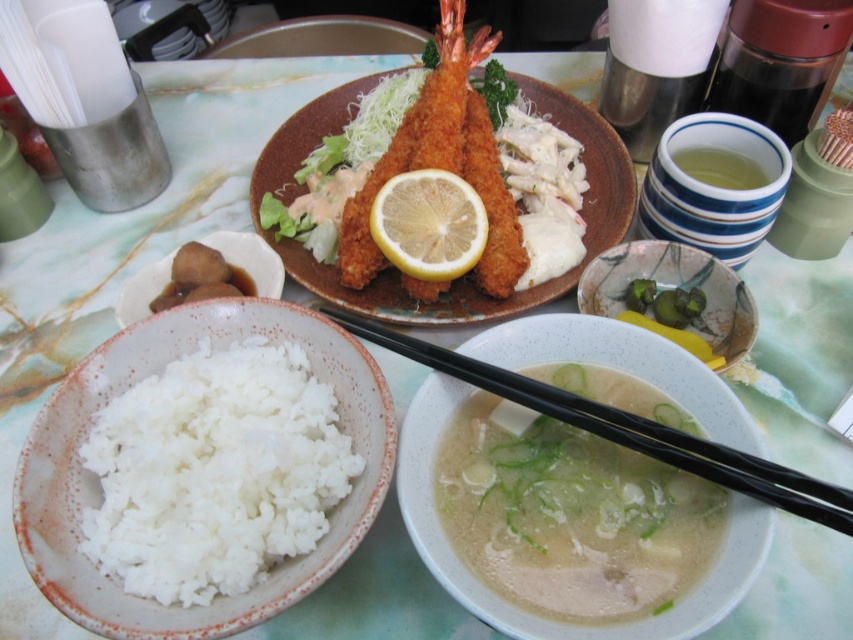
Can you confirm if white creamy soup at center is positioned to the right of speckled ceramic bowl at center?

In fact, white creamy soup at center is to the left of speckled ceramic bowl at center.

Who is higher up, white creamy soup at center or speckled ceramic bowl at center?

Positioned higher is speckled ceramic bowl at center.

Which is in front, point (550, 483) or point (715, 326)?

Point (550, 483) is more forward.

You are a GUI agent. You are given a task and a screenshot of the screen. Output one action in this format:
    pyautogui.click(x=<x>, y=<y>)
    Task: Click on the white creamy soup at center
    
    Given the screenshot: What is the action you would take?
    pyautogui.click(x=572, y=516)

Is golden crispy shrimp at center bigger than speckled ceramic bowl at center?

Yes, golden crispy shrimp at center is bigger than speckled ceramic bowl at center.

Which is above, golden crispy shrimp at center or speckled ceramic bowl at center?

golden crispy shrimp at center is higher up.

At what (x,y) coordinates should I click in order to perform the action: click on golden crispy shrimp at center. Please return your answer as a coordinate pair (x, y). The width and height of the screenshot is (853, 640). Looking at the image, I should click on (444, 170).

Does white creamy soup at center appear on the right side of yellow matte lemon at center?

Correct, you'll find white creamy soup at center to the right of yellow matte lemon at center.

Is the position of white creamy soup at center more distant than that of yellow matte lemon at center?

No, it is not.

Who is more forward, (610, 573) or (376, 225)?

Point (610, 573) is in front.

Locate an element on the screen. white creamy soup at center is located at coordinates (572, 516).